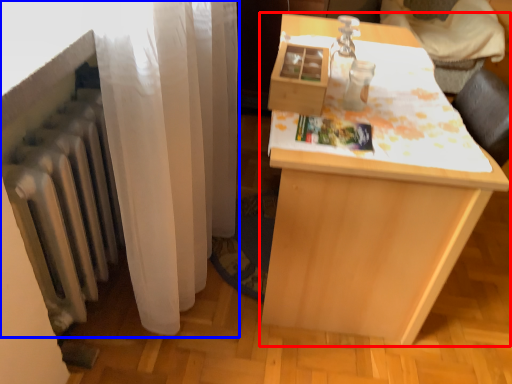
Question: Which object is further to the camera taking this photo, table (highlighted by a red box) or curtain (highlighted by a blue box)?

Choices:
 (A) table
 (B) curtain

Answer: (A)